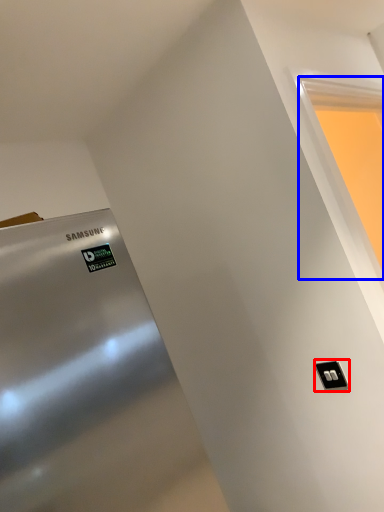
Question: Which object is closer to the camera taking this photo, light switch (highlighted by a red box) or window (highlighted by a blue box)?

Choices:
 (A) light switch
 (B) window

Answer: (B)